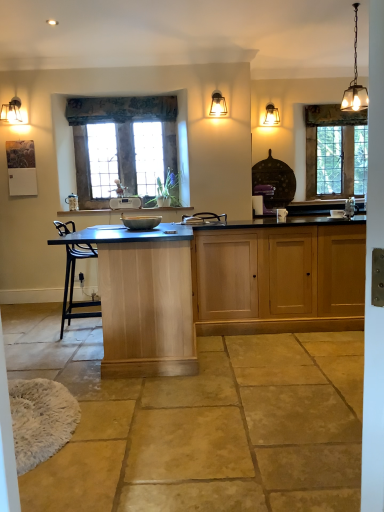
The width and height of the screenshot is (384, 512). Identify the location of free point in front of light wood table at center. (162, 414).